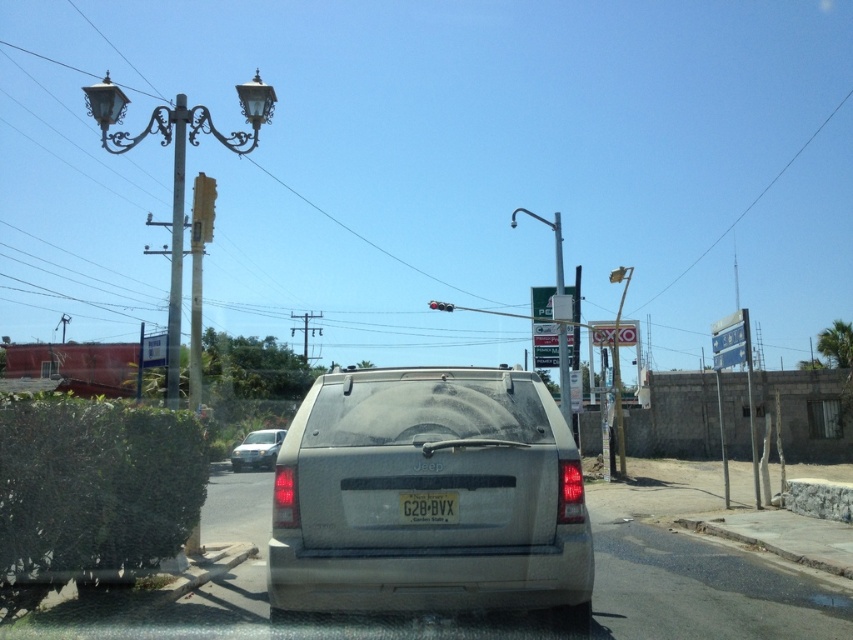
Does gray matte minivan at center appear under metallic traffic light at upper center?

Yes.

This screenshot has width=853, height=640. What do you see at coordinates (428, 490) in the screenshot? I see `gray matte minivan at center` at bounding box center [428, 490].

Does point (276, 557) lie in front of point (212, 202)?

Yes, it is.

This screenshot has height=640, width=853. In order to click on gray matte minivan at center in this screenshot , I will do coord(428,490).

Between metallic gray signpost at upper center and metallic traffic light at upper center, which one has less height?

With less height is metallic traffic light at upper center.

Does point (569, 390) come behind point (209, 184)?

Yes, it is.

Which is in front, point (566, 419) or point (207, 189)?

Positioned in front is point (207, 189).

Image resolution: width=853 pixels, height=640 pixels. What are the coordinates of `metallic gray signpost at upper center` in the screenshot? It's located at (564, 376).

Which of these two, metallic pole at left or green plastic sign at upper center, stands taller?

Standing taller between the two is metallic pole at left.

Measure the distance between metallic pole at left and green plastic sign at upper center.

A distance of 13.34 meters exists between metallic pole at left and green plastic sign at upper center.

Who is more distant from viewer, (172, 292) or (531, 301)?

The point (531, 301) is behind.

Where is `metallic pole at left`? The image size is (853, 640). metallic pole at left is located at coordinates pyautogui.click(x=175, y=248).